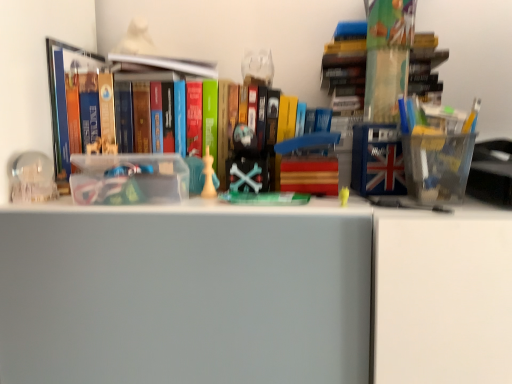
Question: From a real-world perspective, is white matte chess piece at center, the second toy from the left, located beneath transparent glass sphere at left, which appears as the 2th toy when viewed from the right?

Choices:
 (A) yes
 (B) no

Answer: (A)

Question: Can you confirm if white matte chess piece at center, the second toy from the left, is shorter than transparent glass sphere at left, the 1th toy when ordered from left to right?

Choices:
 (A) no
 (B) yes

Answer: (A)

Question: Considering the relative sizes of white matte chess piece at center, the second toy from the left, and transparent glass sphere at left, which appears as the 2th toy when viewed from the right, in the image provided, is white matte chess piece at center, the second toy from the left, taller than transparent glass sphere at left, which appears as the 2th toy when viewed from the right,?

Choices:
 (A) no
 (B) yes

Answer: (B)

Question: Is white matte chess piece at center, which appears as the first toy when viewed from the right, located outside transparent glass sphere at left, which appears as the 2th toy when viewed from the right?

Choices:
 (A) yes
 (B) no

Answer: (A)

Question: From a real-world perspective, is white matte chess piece at center, which appears as the first toy when viewed from the right, on top of transparent glass sphere at left, which appears as the 2th toy when viewed from the right?

Choices:
 (A) no
 (B) yes

Answer: (A)

Question: Is hardcover book at upper center, which is the first book from left to right, spatially inside translucent plastic container at upper right, which appears as the 1th book when viewed from the right, or outside of it?

Choices:
 (A) inside
 (B) outside

Answer: (B)

Question: Considering the relative positions of hardcover book at upper center, marked as the third book in a right-to-left arrangement, and translucent plastic container at upper right, placed as the third book when sorted from left to right, in the image provided, is hardcover book at upper center, marked as the third book in a right-to-left arrangement, to the left or to the right of translucent plastic container at upper right, placed as the third book when sorted from left to right,?

Choices:
 (A) right
 (B) left

Answer: (B)

Question: From a real-world perspective, relative to translucent plastic container at upper right, which appears as the 1th book when viewed from the right, is hardcover book at upper center, which is the first book from left to right, vertically above or below?

Choices:
 (A) below
 (B) above

Answer: (B)

Question: In the image, is hardcover book at upper center, which is the first book from left to right, positioned in front of or behind translucent plastic container at upper right, which appears as the 1th book when viewed from the right?

Choices:
 (A) behind
 (B) front

Answer: (A)

Question: Visually, is translucent plastic container at upper right, placed as the third book when sorted from left to right, positioned to the left or to the right of hardcover book at center, which is the 2th book from right to left?

Choices:
 (A) left
 (B) right

Answer: (B)

Question: In terms of size, does translucent plastic container at upper right, placed as the third book when sorted from left to right, appear bigger or smaller than hardcover book at center, which ranks as the 2th book in left-to-right order?

Choices:
 (A) big
 (B) small

Answer: (B)

Question: In the image, is translucent plastic container at upper right, which appears as the 1th book when viewed from the right, positioned in front of or behind hardcover book at center, which is the 2th book from right to left?

Choices:
 (A) front
 (B) behind

Answer: (A)

Question: Considering the positions of translucent plastic container at upper right, which appears as the 1th book when viewed from the right, and hardcover book at center, which ranks as the 2th book in left-to-right order, in the image, is translucent plastic container at upper right, which appears as the 1th book when viewed from the right, wider or thinner than hardcover book at center, which ranks as the 2th book in left-to-right order,?

Choices:
 (A) wide
 (B) thin

Answer: (B)

Question: Is transparent glass sphere at left, the 1th toy when ordered from left to right, taller or shorter than hardcover book at center, which ranks as the 2th book in left-to-right order?

Choices:
 (A) tall
 (B) short

Answer: (B)

Question: Does point (44, 170) appear closer or farther from the camera than point (69, 119)?

Choices:
 (A) farther
 (B) closer

Answer: (B)